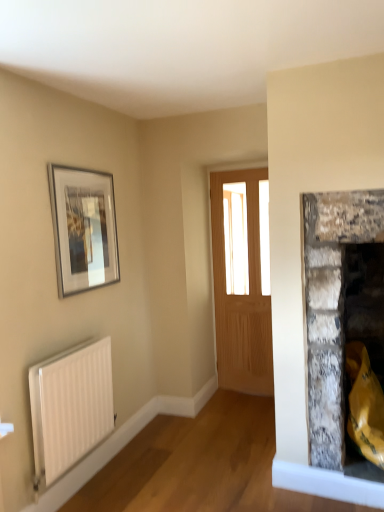
Question: Does silver metallic picture frame at upper left lie behind white matte radiator at lower left?

Choices:
 (A) no
 (B) yes

Answer: (B)

Question: From the image's perspective, is silver metallic picture frame at upper left on white matte radiator at lower left?

Choices:
 (A) no
 (B) yes

Answer: (B)

Question: Does silver metallic picture frame at upper left have a lesser width compared to white matte radiator at lower left?

Choices:
 (A) yes
 (B) no

Answer: (A)

Question: Is silver metallic picture frame at upper left outside white matte radiator at lower left?

Choices:
 (A) no
 (B) yes

Answer: (B)

Question: From a real-world perspective, is silver metallic picture frame at upper left on top of white matte radiator at lower left?

Choices:
 (A) no
 (B) yes

Answer: (B)

Question: Is silver metallic picture frame at upper left at the left side of white matte radiator at lower left?

Choices:
 (A) yes
 (B) no

Answer: (B)

Question: Is silver metallic picture frame at upper left to the left of light brown wooden door at center from the viewer's perspective?

Choices:
 (A) no
 (B) yes

Answer: (B)

Question: Is silver metallic picture frame at upper left shorter than light brown wooden door at center?

Choices:
 (A) no
 (B) yes

Answer: (B)

Question: Does silver metallic picture frame at upper left have a smaller size compared to light brown wooden door at center?

Choices:
 (A) yes
 (B) no

Answer: (A)

Question: Is silver metallic picture frame at upper left taller than light brown wooden door at center?

Choices:
 (A) yes
 (B) no

Answer: (B)

Question: Can you confirm if silver metallic picture frame at upper left is thinner than light brown wooden door at center?

Choices:
 (A) yes
 (B) no

Answer: (A)

Question: From the image's perspective, is silver metallic picture frame at upper left over light brown wooden door at center?

Choices:
 (A) yes
 (B) no

Answer: (A)

Question: Is light brown wooden door at center directly adjacent to silver metallic picture frame at upper left?

Choices:
 (A) no
 (B) yes

Answer: (A)